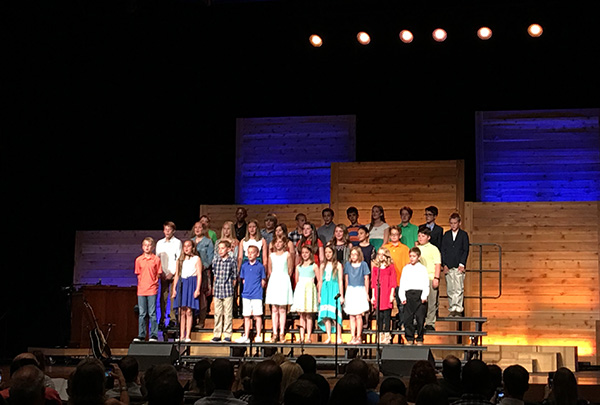
Identify the location of wood wall. (542, 284).